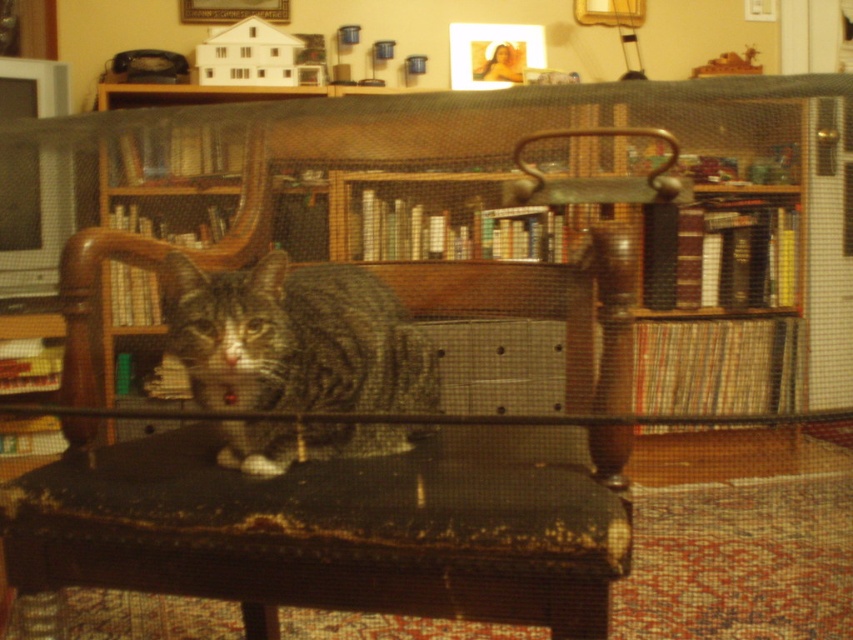
You are a guest in this room and want to sit down. You see the dark brown leather armchair at center and the wooden bookshelf at center. Which one is more suitable for sitting?

The dark brown leather armchair at center is more suitable for sitting because it is smaller in size compared to the wooden bookshelf at center, which is larger and meant for holding items.

You are a delivery person who needs to place a large package that is 30 inches wide between the dark brown wooden table at center and the wooden bookshelf at center. Can you fit the package between them?

The dark brown wooden table at center and wooden bookshelf at center are 28.51 inches apart from each other. Since the package is 30 inches wide, which is wider than the space between them, the package cannot fit between them.

You are sitting on the dark brown leather armchair at center and want to reach a book on the wooden bookshelf at center. Can you easily reach it without getting up?

The dark brown leather armchair at center is closer to the viewer than the wooden bookshelf at center, so you would need to get up to reach the book since it is further away.